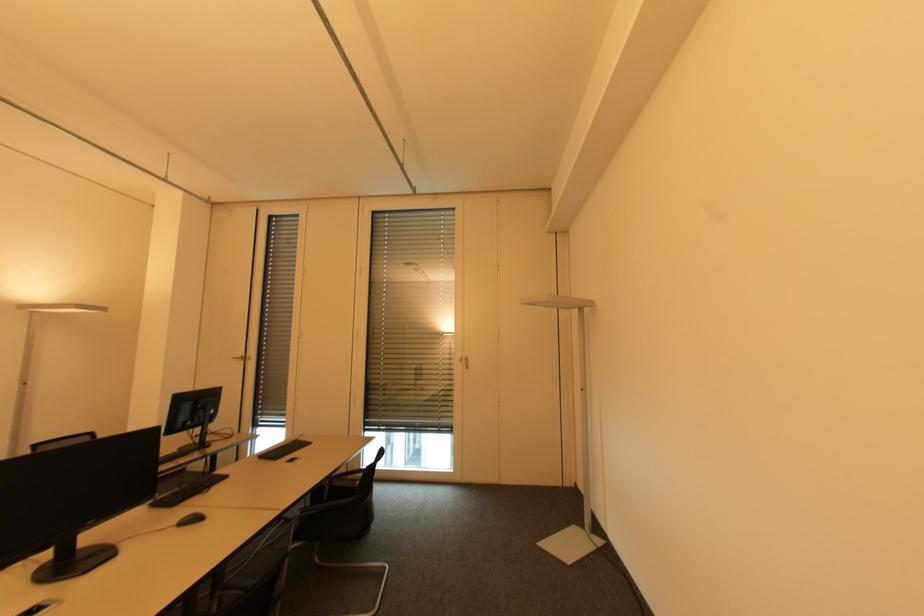
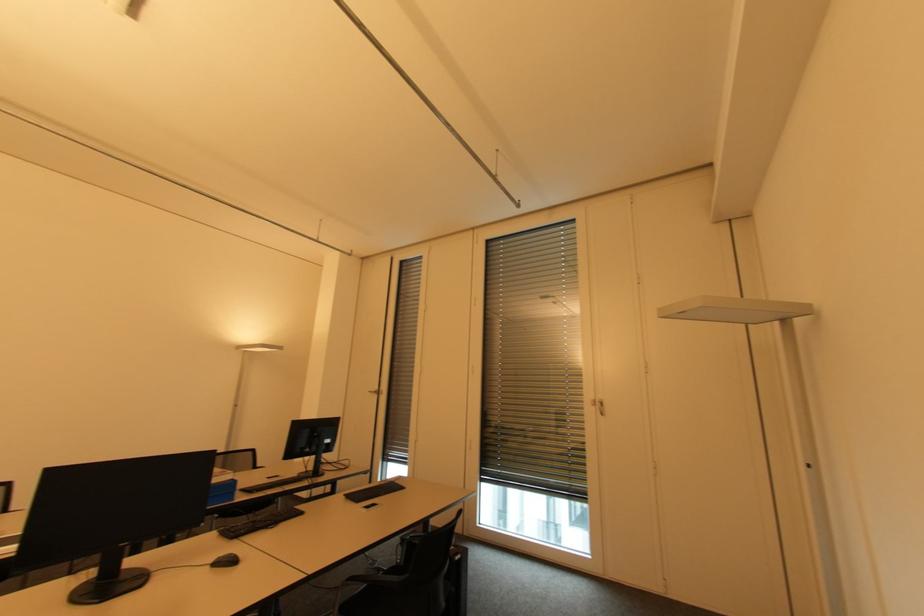
Where in the second image is the point corresponding to point 176,529 from the first image?

(210, 567)